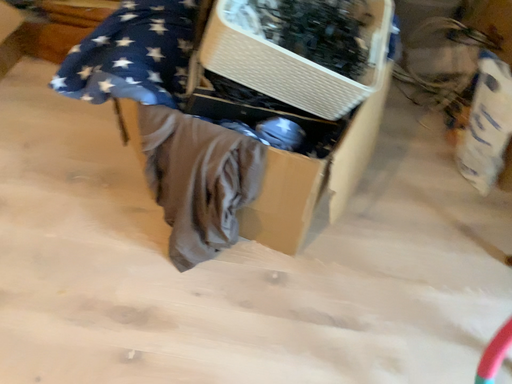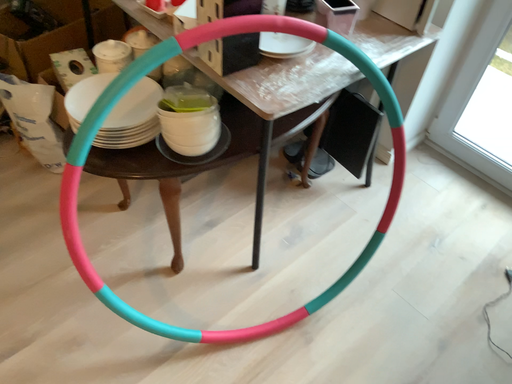
Question: How did the camera likely rotate when shooting the video?

Choices:
 (A) rotated left
 (B) rotated right

Answer: (B)